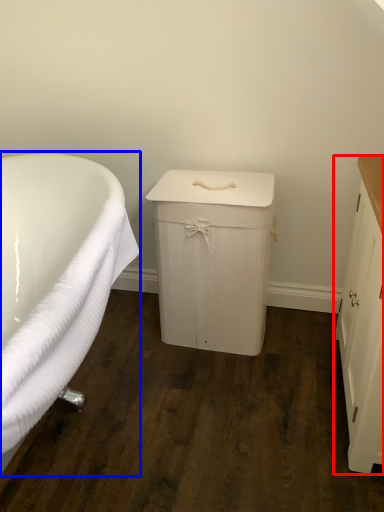
Question: Which object appears farthest to the camera in this image, cabinetry (highlighted by a red box) or bathtub (highlighted by a blue box)?

Choices:
 (A) cabinetry
 (B) bathtub

Answer: (A)